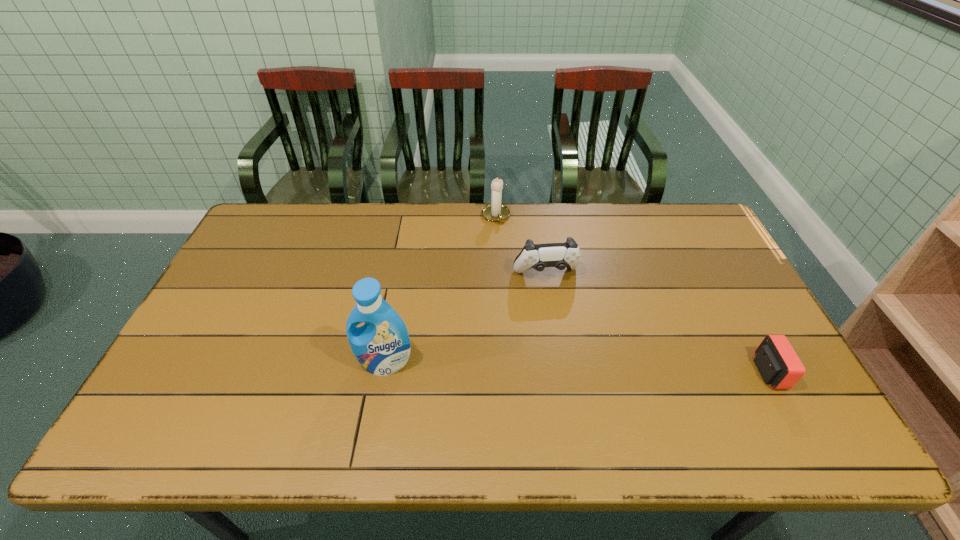
Where is `free space between the third tallest object and the leftmost object`? This screenshot has height=540, width=960. free space between the third tallest object and the leftmost object is located at coordinates [x=466, y=319].

The height and width of the screenshot is (540, 960). I want to click on vacant area between the rightmost object and the leftmost object, so click(x=577, y=368).

The width and height of the screenshot is (960, 540). Identify the location of unoccupied area between the rightmost object and the leftmost object. (577, 368).

The image size is (960, 540). In order to click on free area in between the alarm clock and the leftmost object in this screenshot , I will do pyautogui.click(x=577, y=368).

Identify which object is the third nearest to the candle holder. Please provide its 2D coordinates. Your answer should be formatted as a tuple, i.e. [(x, y)], where the tuple contains the x and y coordinates of a point satisfying the conditions above.

[(775, 359)]

Identify the location of object that is the closest one to the candle holder. (559, 255).

Where is `vacant area that satisfies the following two spatial constraints: 1. on the front-facing side of the detergent; 2. on the front-facing side of the rightmost object`? vacant area that satisfies the following two spatial constraints: 1. on the front-facing side of the detergent; 2. on the front-facing side of the rightmost object is located at coordinates (384, 372).

What are the coordinates of `free space that satisfies the following two spatial constraints: 1. on the front side of the alarm clock; 2. on the front-facing side of the third tallest object` in the screenshot? It's located at (561, 372).

At what (x,y) coordinates should I click in order to perform the action: click on free space that satisfies the following two spatial constraints: 1. on the front-facing side of the rightmost object; 2. on the front-facing side of the detergent. Please return your answer as a coordinate pair (x, y). The height and width of the screenshot is (540, 960). Looking at the image, I should click on (384, 372).

The width and height of the screenshot is (960, 540). Find the location of `free space that satisfies the following two spatial constraints: 1. on the front side of the farthest object; 2. on the front-facing side of the shortest object`. free space that satisfies the following two spatial constraints: 1. on the front side of the farthest object; 2. on the front-facing side of the shortest object is located at coordinates (502, 372).